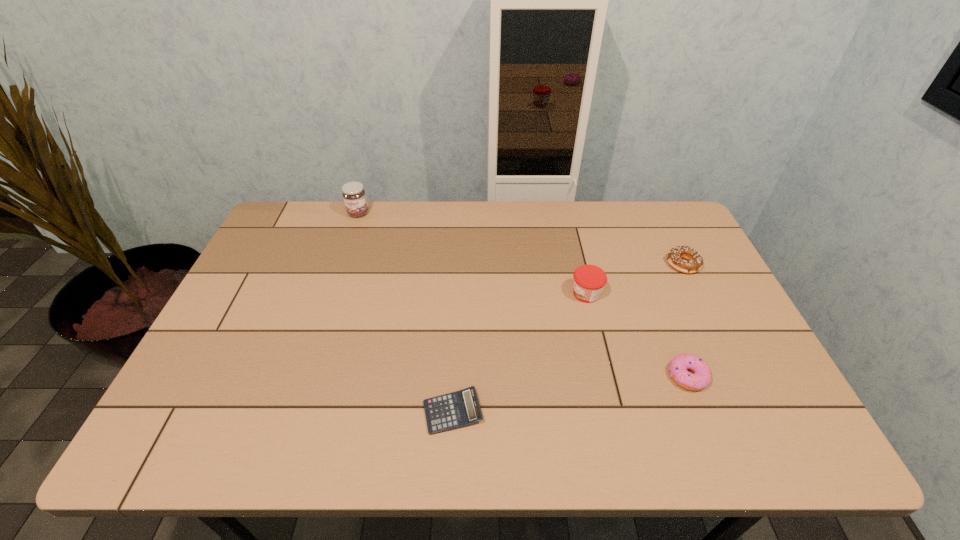
In order to click on the tallest object in this screenshot , I will do point(353,193).

You are a GUI agent. You are given a task and a screenshot of the screen. Output one action in this format:
    pyautogui.click(x=<x>, y=<y>)
    Task: Click on the farther jam
    
    Given the screenshot: What is the action you would take?
    pyautogui.click(x=353, y=193)

You are a GUI agent. You are given a task and a screenshot of the screen. Output one action in this format:
    pyautogui.click(x=<x>, y=<y>)
    Task: Click on the shorter jam
    This screenshot has height=540, width=960.
    Given the screenshot: What is the action you would take?
    pyautogui.click(x=589, y=280)

I want to click on the fourth shortest object, so click(589, 280).

You are a GUI agent. You are given a task and a screenshot of the screen. Output one action in this format:
    pyautogui.click(x=<x>, y=<y>)
    Task: Click on the right doughnut
    Image resolution: width=960 pixels, height=540 pixels.
    Given the screenshot: What is the action you would take?
    pyautogui.click(x=695, y=261)

At what (x,y) coordinates should I click in order to perform the action: click on the rightmost object. Please return your answer as a coordinate pair (x, y). This screenshot has width=960, height=540. Looking at the image, I should click on (695, 261).

Identify the location of the nearer doughnut. The image size is (960, 540). point(701,378).

Where is `the left doughnut`? the left doughnut is located at coordinates (701, 378).

Where is `the shortest object`? The width and height of the screenshot is (960, 540). the shortest object is located at coordinates (461, 408).

Identify the location of calculator. (461, 408).